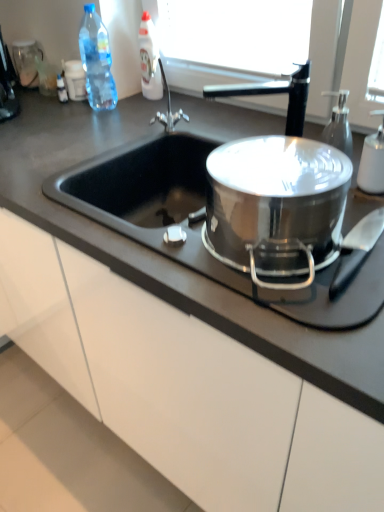
You are a GUI agent. You are given a task and a screenshot of the screen. Output one action in this format:
    pyautogui.click(x=<x>, y=<y>)
    Task: Click on the free spot to the right of transparent plastic bottle at upper left, the 2th bottle positioned from the top
    The height and width of the screenshot is (512, 384).
    Given the screenshot: What is the action you would take?
    pyautogui.click(x=141, y=106)